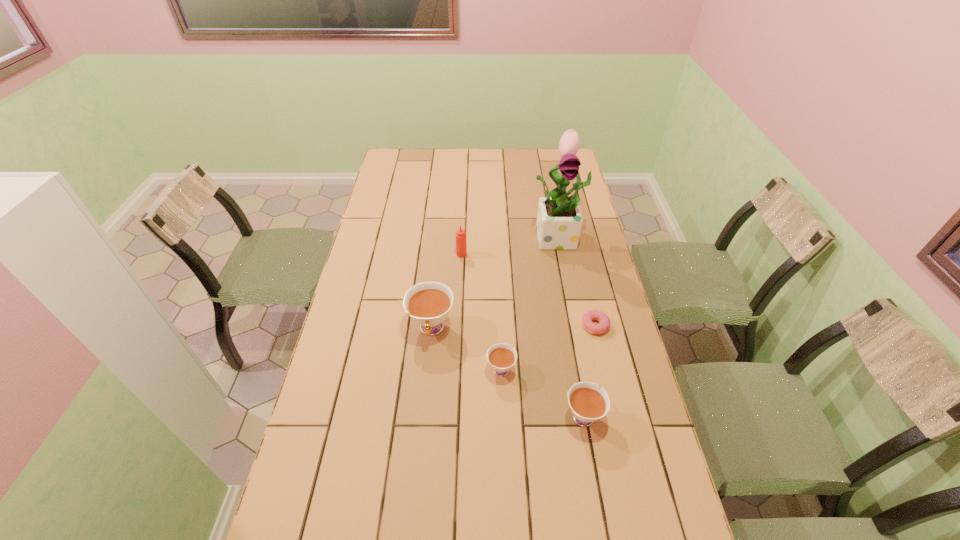
You are a GUI agent. You are given a task and a screenshot of the screen. Output one action in this format:
    pyautogui.click(x=<x>, y=<y>)
    Task: Click on the free region located 0.230m on the side of the shortest teacup with the handle
    
    Given the screenshot: What is the action you would take?
    pyautogui.click(x=498, y=299)

In order to click on vacant space situated on the side of the shortest teacup with the handle in this screenshot , I will do `click(500, 336)`.

At what (x,y) coordinates should I click in order to perform the action: click on free space located on the side of the shortest teacup with the handle. Please return your answer as a coordinate pair (x, y). This screenshot has height=540, width=960. Looking at the image, I should click on (498, 286).

You are a GUI agent. You are given a task and a screenshot of the screen. Output one action in this format:
    pyautogui.click(x=<x>, y=<y>)
    Task: Click on the vacant space located on the side of the nearest object with the handle
    The width and height of the screenshot is (960, 540).
    Given the screenshot: What is the action you would take?
    pyautogui.click(x=572, y=354)

Identify the location of free space located 0.180m on the side of the nearest object with the handle. (570, 343).

Where is `free space located 0.240m on the side of the nearest object with the handle`? The width and height of the screenshot is (960, 540). free space located 0.240m on the side of the nearest object with the handle is located at coordinates (567, 328).

Find the location of `vacant space located on the front of the Tabasco sauce`. vacant space located on the front of the Tabasco sauce is located at coordinates point(461,285).

At what (x,y) coordinates should I click in order to perform the action: click on vacant space located on the front-facing side of the tallest object. Please return your answer as a coordinate pair (x, y). Looking at the image, I should click on (579, 334).

Identify the location of free space located on the front of the shortest object. The image size is (960, 540). (628, 463).

Where is `teacup present at the right edge`? This screenshot has height=540, width=960. teacup present at the right edge is located at coordinates coord(588,404).